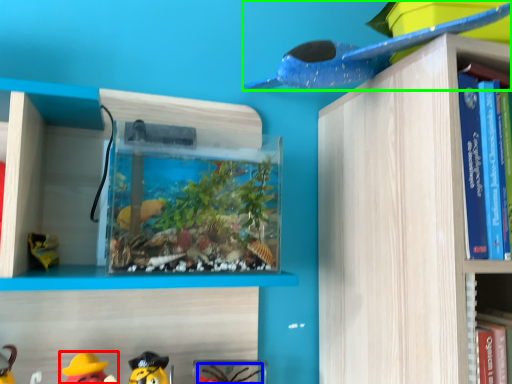
Question: Considering the real-world distances, which object is closest to toy (highlighted by a red box)? toy (highlighted by a blue box) or toy (highlighted by a green box).

Choices:
 (A) toy
 (B) toy

Answer: (A)